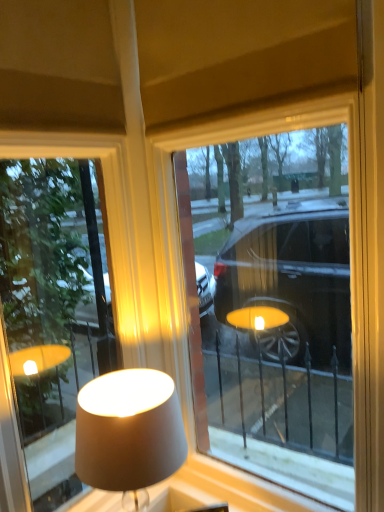
Find the location of a particular element. The width and height of the screenshot is (384, 512). matte gray lampshade at lower center is located at coordinates (129, 433).

What is the approximate width of matte gray lampshade at lower center?

It is 9.62 inches.

Describe the element at coordinates (129, 433) in the screenshot. Image resolution: width=384 pixels, height=512 pixels. I see `matte gray lampshade at lower center` at that location.

Find the location of `matte gray lampshade at lower center`. matte gray lampshade at lower center is located at coordinates (129, 433).